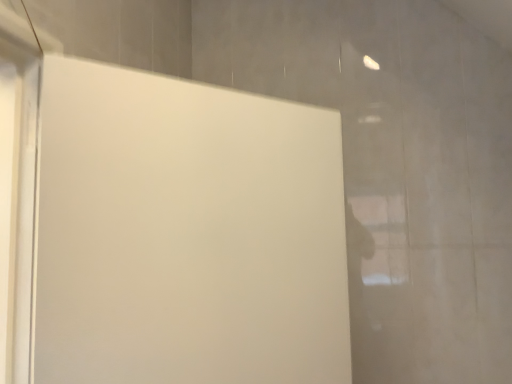
Image resolution: width=512 pixels, height=384 pixels. Describe the element at coordinates (186, 233) in the screenshot. I see `white matte door at center` at that location.

Where is `white matte door at center`? white matte door at center is located at coordinates (186, 233).

Where is `white matte door at center`? The width and height of the screenshot is (512, 384). white matte door at center is located at coordinates (186, 233).